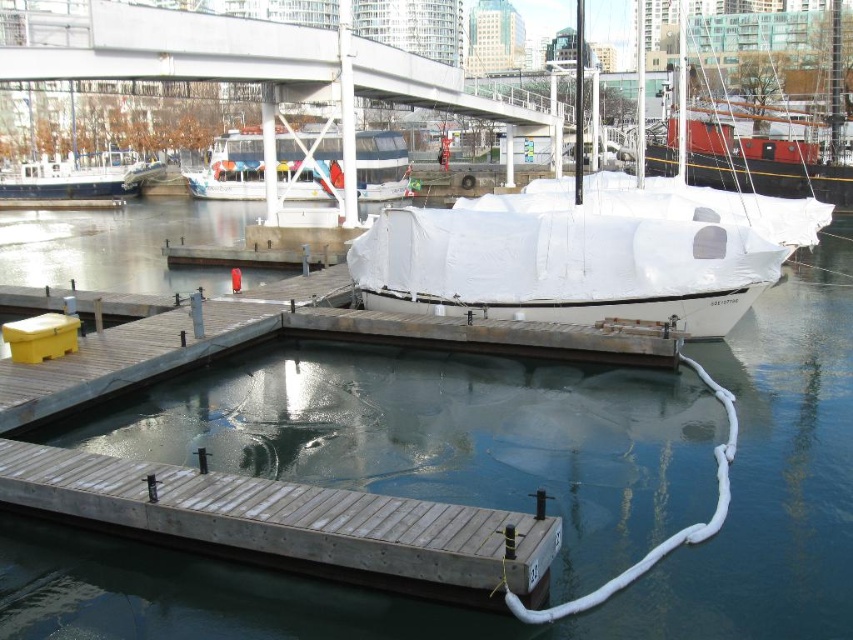
You are a dock worker checking the marina. You notice the white matte boat at center and the white tarpaulin boat at center. Which one is positioned lower in the image?

The white matte boat at center is located below the white tarpaulin boat at center, so it is positioned lower in the image.

You are a dock worker who needs to secure both the white matte boat at center and the white tarpaulin boat at center. Since they are both at the center, which one should you approach first if you want to start from the left side of the pier?

The white matte boat at center is to the left of the white tarpaulin boat at center, so you should approach the white matte boat at center first.

You are standing at the center of the image and want to walk to the wooden dock at lower left. Which direction should you move?

Since the wooden dock at lower left is located at point (x=289, y=524), you should move towards the lower left direction to reach it.